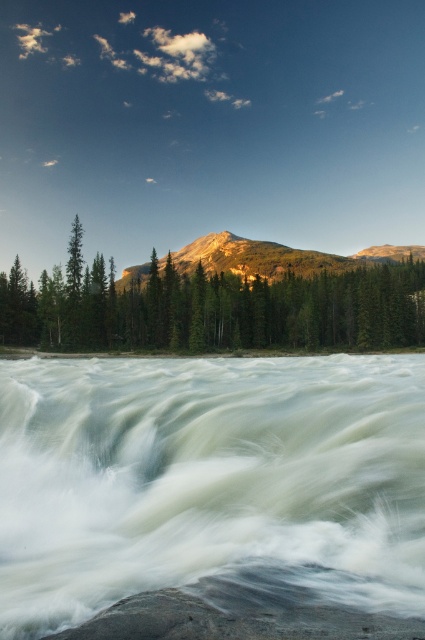
Does white frothy water at center have a greater width compared to green matte tree at center?

In fact, white frothy water at center might be narrower than green matte tree at center.

Does point (17, 369) come in front of point (311, 284)?

Yes, it is.

Is point (285, 577) closer to viewer compared to point (368, 292)?

Yes, it is in front of point (368, 292).

The height and width of the screenshot is (640, 425). I want to click on white frothy water at center, so click(x=209, y=483).

Between white frothy water at center and rocky brown mountain at center, which one has less height?

white frothy water at center

Does point (158, 403) come in front of point (235, 248)?

Yes, it is in front of point (235, 248).

Between point (294, 516) and point (209, 246), which one is positioned in front?

Positioned in front is point (294, 516).

Find the location of a particular element. This screenshot has height=640, width=425. white frothy water at center is located at coordinates (209, 483).

Does green matte tree at center have a lesser height compared to rocky brown mountain at center?

Yes, green matte tree at center is shorter than rocky brown mountain at center.

I want to click on green matte tree at center, so click(210, 307).

Locate an element on the screen. green matte tree at center is located at coordinates (210, 307).